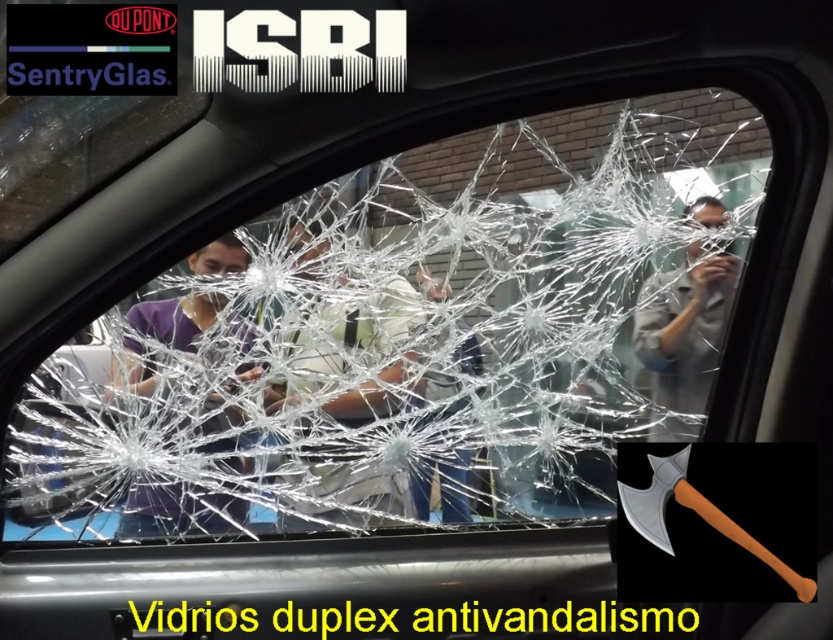
Question: Is transparent glass at center closer to camera compared to matte gray shirt at center?

Choices:
 (A) no
 (B) yes

Answer: (B)

Question: Which of these objects is positioned closest to the matte black shirt at center?

Choices:
 (A) matte gray shirt at center
 (B) silver metallic axe at center

Answer: (B)

Question: Which point is closer to the camera?

Choices:
 (A) (771, 497)
 (B) (424, 388)
 (C) (672, 342)
 (D) (163, 509)

Answer: (A)

Question: Which of the following is the farthest from the observer?

Choices:
 (A) (325, 310)
 (B) (479, 358)
 (C) (697, 320)
 (D) (691, 596)

Answer: (B)

Question: Is transparent glass at center in front of blue denim jeans at center?

Choices:
 (A) yes
 (B) no

Answer: (A)

Question: Does matte black shirt at center have a lesser width compared to blue denim jeans at center?

Choices:
 (A) yes
 (B) no

Answer: (B)